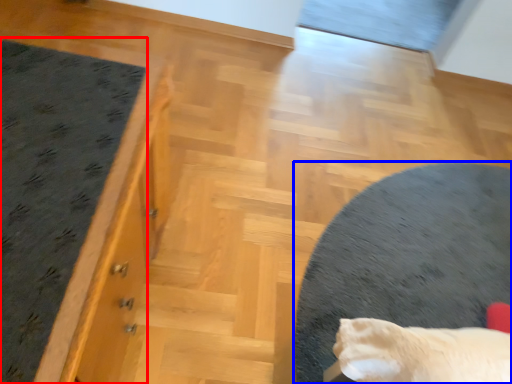
Question: Among these objects, which one is farthest to the camera, mat (highlighted by a red box) or furniture (highlighted by a blue box)?

Choices:
 (A) mat
 (B) furniture

Answer: (B)